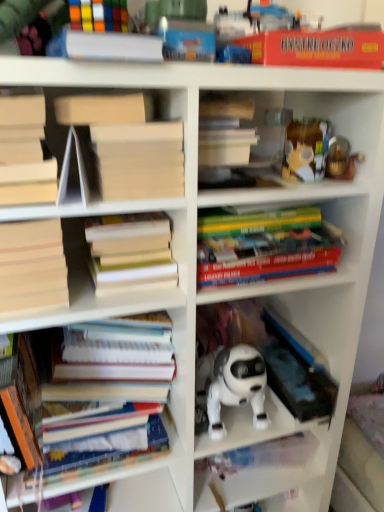
Question: Is translucent plastic container at upper right, arranged as the second toy when viewed from the right, next to hardcover books at center, which is the fourth book in bottom-to-top order, and touching it?

Choices:
 (A) yes
 (B) no

Answer: (B)

Question: Considering the relative sizes of translucent plastic container at upper right, which is counted as the 1th toy, starting from the left, and hardcover books at center, which is the fourth book in bottom-to-top order, in the image provided, is translucent plastic container at upper right, which is counted as the 1th toy, starting from the left, shorter than hardcover books at center, which is the fourth book in bottom-to-top order,?

Choices:
 (A) yes
 (B) no

Answer: (A)

Question: Is translucent plastic container at upper right, which is counted as the 1th toy, starting from the left, to the left of hardcover books at center, which is the fourth book in bottom-to-top order, from the viewer's perspective?

Choices:
 (A) yes
 (B) no

Answer: (B)

Question: Is there a large distance between translucent plastic container at upper right, arranged as the second toy when viewed from the right, and hardcover books at center, which is the fourth book from top to bottom?

Choices:
 (A) no
 (B) yes

Answer: (A)

Question: Is translucent plastic container at upper right, which is counted as the 1th toy, starting from the left, not inside hardcover books at center, which is the fourth book in bottom-to-top order?

Choices:
 (A) yes
 (B) no

Answer: (A)

Question: Looking at the image, does hardcover book at center, which is the second book in top-to-bottom order, seem bigger or smaller compared to white plastic robot at center?

Choices:
 (A) small
 (B) big

Answer: (B)

Question: From the image's perspective, is hardcover book at center, the 6th book from the bottom, located above or below white plastic robot at center?

Choices:
 (A) below
 (B) above

Answer: (B)

Question: Considering the positions of hardcover book at center, the 6th book from the bottom, and white plastic robot at center in the image, is hardcover book at center, the 6th book from the bottom, wider or thinner than white plastic robot at center?

Choices:
 (A) thin
 (B) wide

Answer: (A)

Question: Is hardcover book at center, the 6th book from the bottom, spatially inside white plastic robot at center, or outside of it?

Choices:
 (A) inside
 (B) outside

Answer: (B)

Question: Is translucent plastic container at upper right, arranged as the second toy when viewed from the right, taller or shorter than red matte board game box at upper right, marked as the 2th paperback book in a left-to-right arrangement?

Choices:
 (A) tall
 (B) short

Answer: (A)

Question: Looking at their shapes, would you say translucent plastic container at upper right, which is counted as the 1th toy, starting from the left, is wider or thinner than red matte board game box at upper right, marked as the 2th paperback book in a left-to-right arrangement?

Choices:
 (A) thin
 (B) wide

Answer: (A)

Question: Which is correct: translucent plastic container at upper right, which is counted as the 1th toy, starting from the left, is inside red matte board game box at upper right, placed as the 1th paperback book when sorted from right to left, or outside of it?

Choices:
 (A) outside
 (B) inside

Answer: (A)

Question: Would you say translucent plastic container at upper right, which is counted as the 1th toy, starting from the left, is to the left or to the right of red matte board game box at upper right, placed as the 1th paperback book when sorted from right to left, in the picture?

Choices:
 (A) right
 (B) left

Answer: (A)

Question: Considering their positions, is rubberized plastic toy at upper center located in front of or behind white matte book at upper left, acting as the fifth book starting from the bottom?

Choices:
 (A) front
 (B) behind

Answer: (A)

Question: Would you say rubberized plastic toy at upper center is inside or outside white matte book at upper left, placed as the third book when sorted from top to bottom?

Choices:
 (A) inside
 (B) outside

Answer: (B)